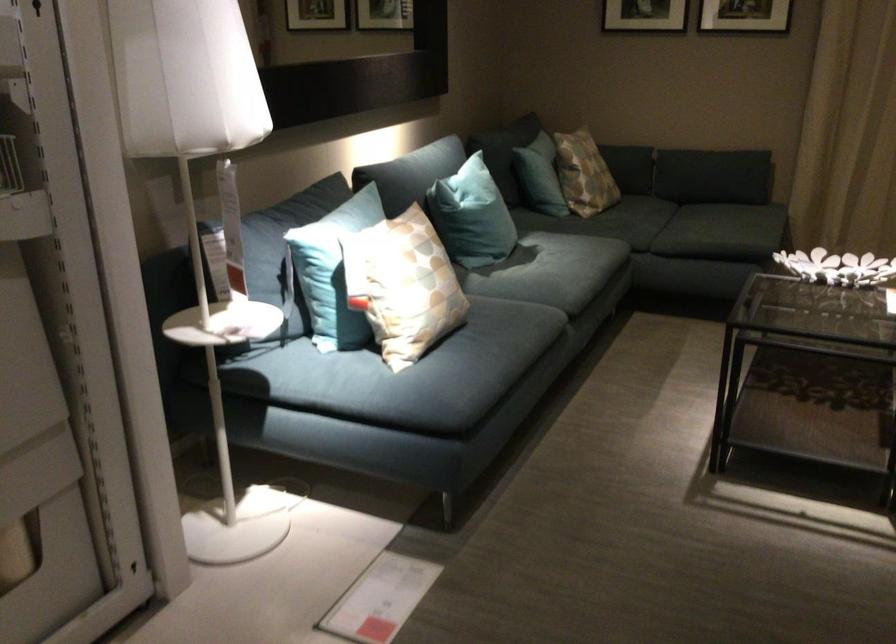
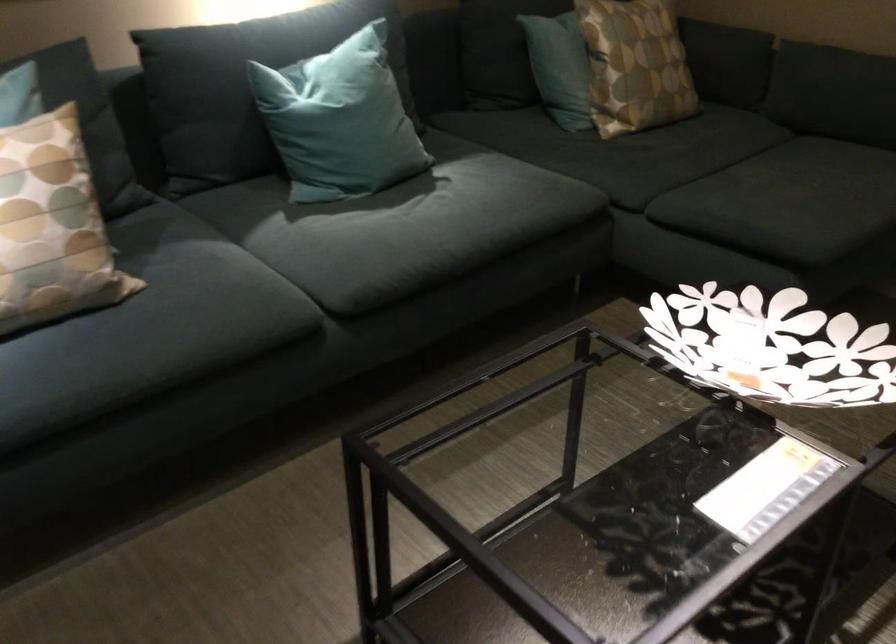
Which direction would the cameraman need to move to produce the second image?

The cameraman walked toward right, forward.